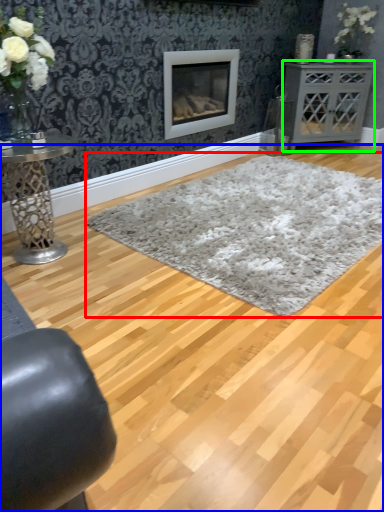
Question: Estimate the real-world distances between objects in this image. Which object is closer to plain (highlighted by a red box), plain (highlighted by a blue box) or table (highlighted by a green box)?

Choices:
 (A) plain
 (B) table

Answer: (A)